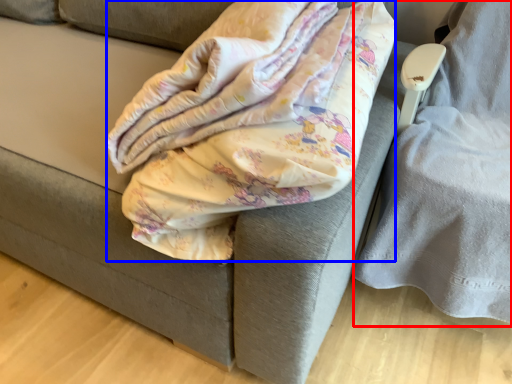
Question: Which of the following is the closest to the observer, swivel chair (highlighted by a red box) or blanket (highlighted by a blue box)?

Choices:
 (A) swivel chair
 (B) blanket

Answer: (B)